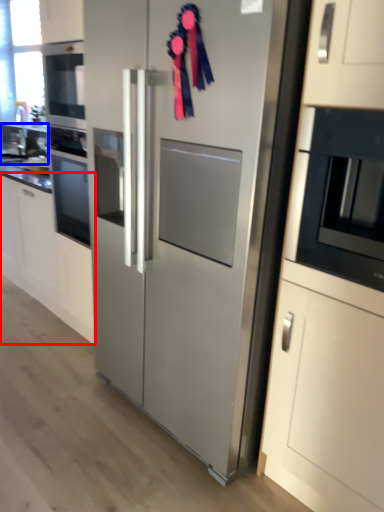
Question: Which object is further to the camera taking this photo, cabinetry (highlighted by a red box) or sink (highlighted by a blue box)?

Choices:
 (A) cabinetry
 (B) sink

Answer: (B)